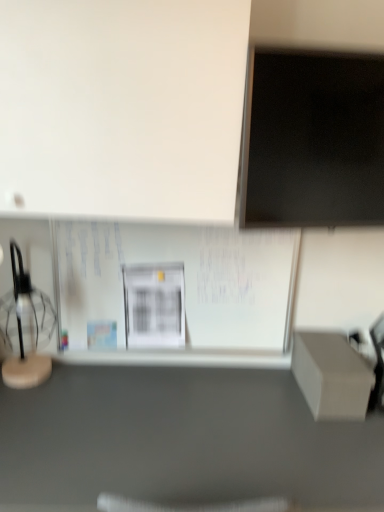
Question: Is matte gray box at lower right in front of or behind white paperboard at center in the image?

Choices:
 (A) front
 (B) behind

Answer: (A)

Question: Considering the positions of matte gray box at lower right and white paperboard at center in the image, is matte gray box at lower right bigger or smaller than white paperboard at center?

Choices:
 (A) big
 (B) small

Answer: (A)

Question: Estimate the real-world distances between objects in this image. Which object is farther from the translucent glass table lamp at left?

Choices:
 (A) white paperboard at center
 (B) black matte computer monitor at upper right
 (C) matte gray box at lower right

Answer: (B)

Question: Which is nearer to the white paperboard at center?

Choices:
 (A) translucent glass table lamp at left
 (B) matte gray box at lower right
 (C) black matte computer monitor at upper right

Answer: (A)